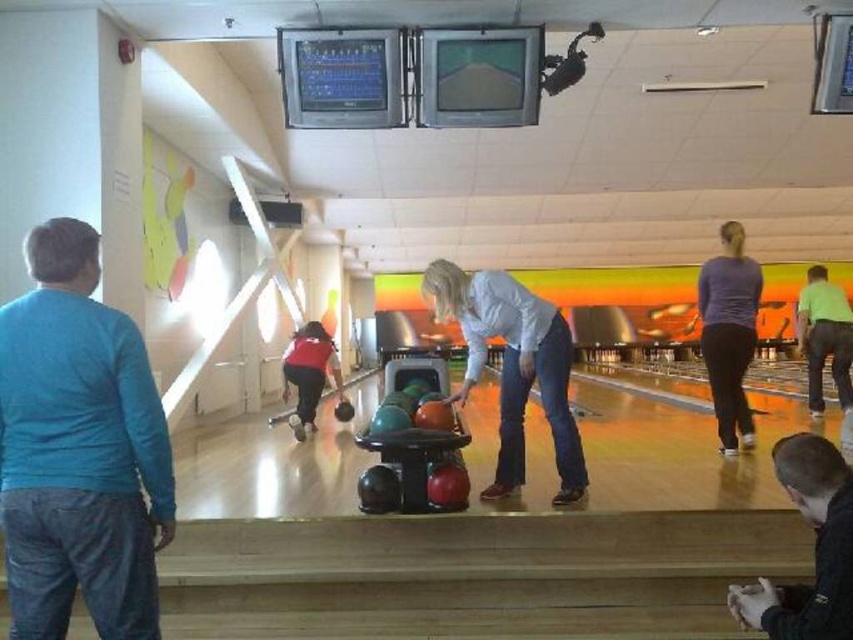
Question: Estimate the real-world distances between objects in this image. Which object is closer to the purple matte shirt at right?

Choices:
 (A) green matte bowling ball at center
 (B) red fabric bowling ball at center
 (C) blue cotton shirt at left
 (D) black matte bowling ball at lower right

Answer: (A)

Question: Which object is the closest to the matte orange bowling ball at center?

Choices:
 (A) blue cotton shirt at left
 (B) black matte bowling ball at lower right

Answer: (B)

Question: Is black matte bowling ball at lower right wider than green matte bowling ball at center?

Choices:
 (A) yes
 (B) no

Answer: (B)

Question: Where is matte orange bowling ball at center located in relation to red fabric bowling ball at center in the image?

Choices:
 (A) right
 (B) left

Answer: (A)

Question: Is the position of blue cotton shirt at left less distant than that of matte orange bowling ball at center?

Choices:
 (A) yes
 (B) no

Answer: (A)

Question: Based on their relative distances, which object is nearer to the green matte bowling ball at center?

Choices:
 (A) purple matte shirt at right
 (B) matte orange bowling ball at center

Answer: (A)